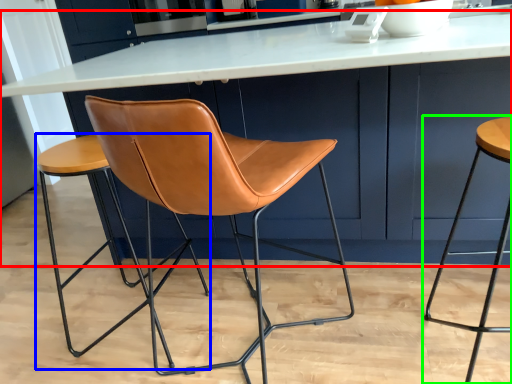
Question: Estimate the real-world distances between objects in this image. Which object is closer to table (highlighted by a red box), stool (highlighted by a blue box) or stool (highlighted by a green box)?

Choices:
 (A) stool
 (B) stool

Answer: (A)